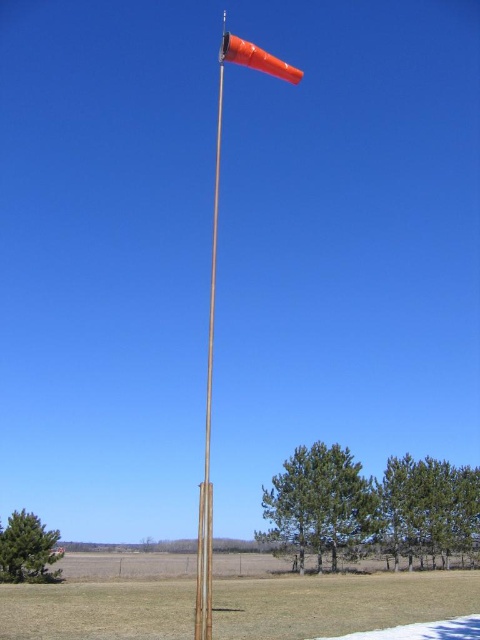
Between wooden flag pole at center and orange matte windsock at upper center, which one appears on the right side from the viewer's perspective?

orange matte windsock at upper center is more to the right.

Is point (208, 376) positioned before point (242, 65)?

No.

Does point (208, 557) come farther from viewer compared to point (275, 56)?

No, (208, 557) is closer to viewer.

The width and height of the screenshot is (480, 640). I want to click on wooden flag pole at center, so click(x=207, y=424).